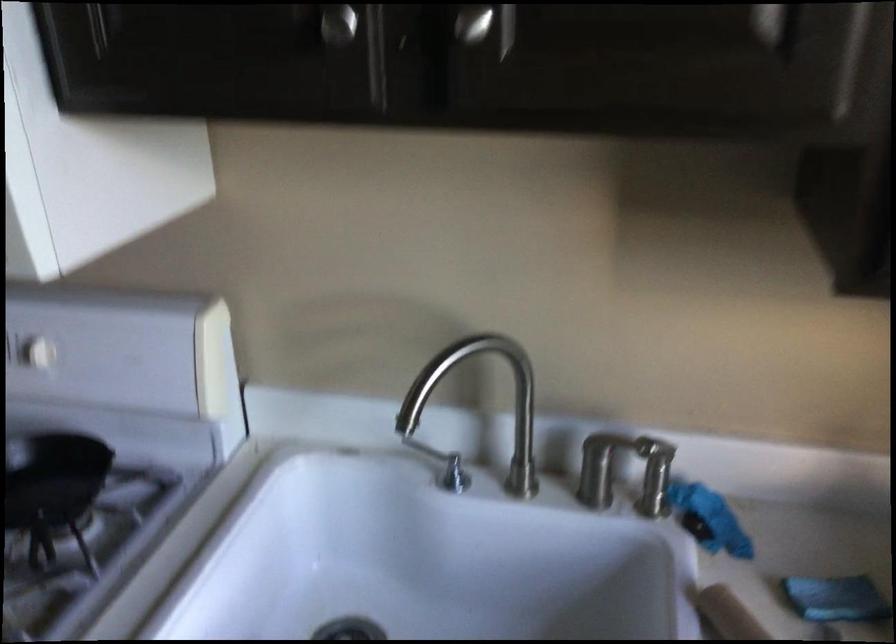
What do you see at coordinates (606, 465) in the screenshot? I see `the soap dispenser pump` at bounding box center [606, 465].